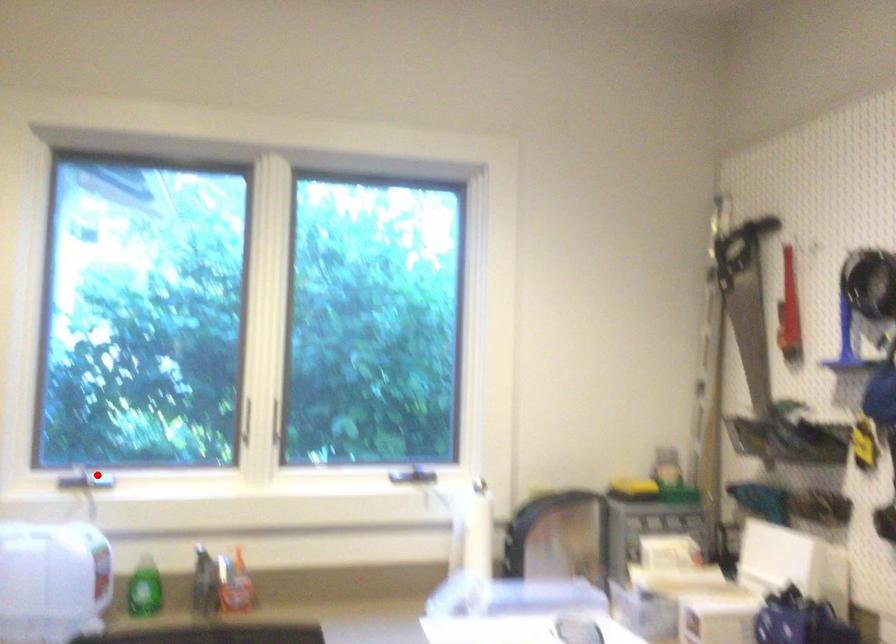
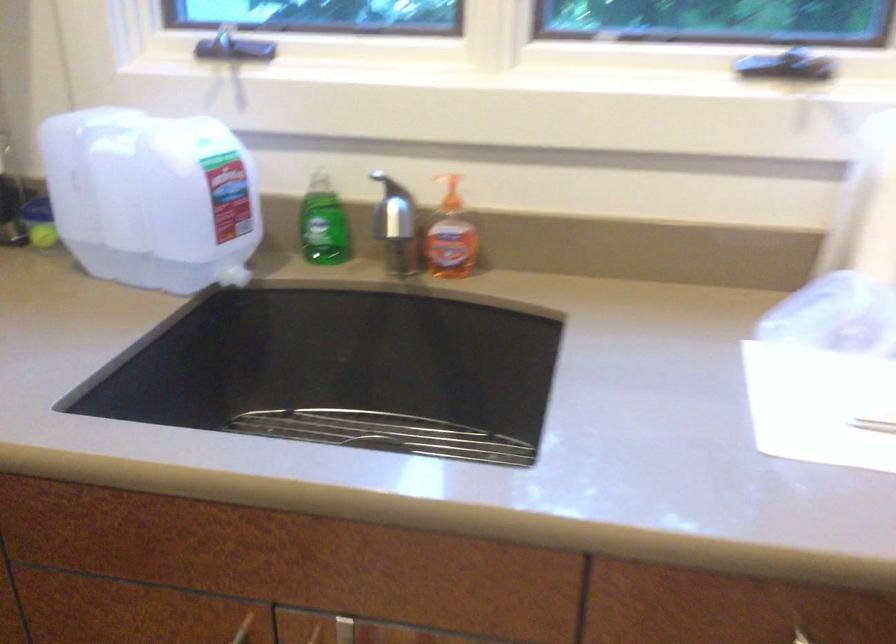
Question: I am providing you with two images of the same scene from different viewpoints. In image1, a red point is highlighted. Considering the same 3D point in image2, which of the following is correct?

Choices:
 (A) It is closer
 (B) It is farther

Answer: (A)